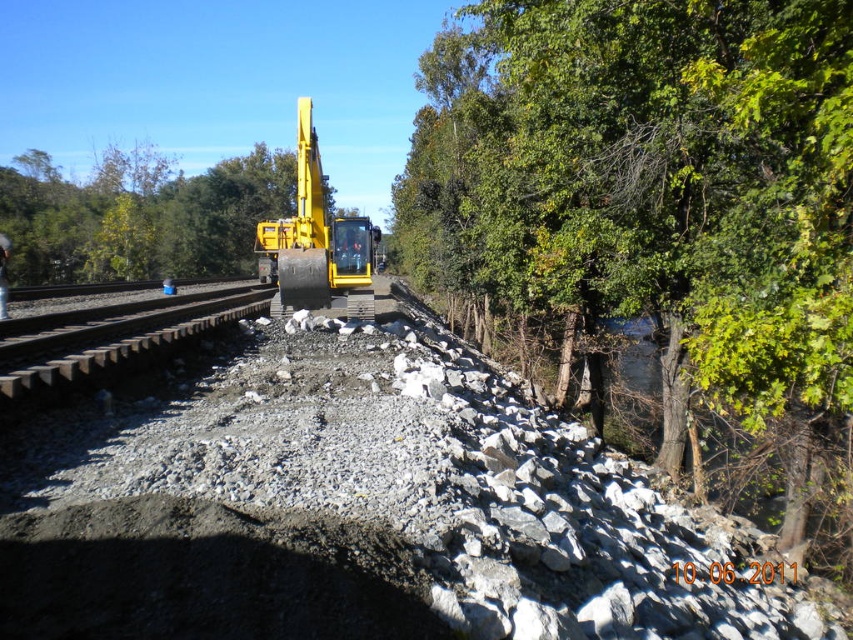
You are a pedestrian standing on the sidewalk next to the railway track. You see the green leafy tree at center and the gray gravel train track at left. Which object is higher in elevation?

The green leafy tree at center is above the gray gravel train track at left, so the green leafy tree at center is higher in elevation.

You are a surveyor standing at point 0.5, 0.5 in the image coordinate system. You need to locate the green leafy tree at center. In which direction should you move to reach it?

The green leafy tree at center is located at point (x=140, y=216). Since your current position is at (x=426, y=320), you should move towards the northwest direction to reach it.

You are a worker standing near the railway tracks and need to move the yellow metallic excavator at center to a safer location away from the green leafy tree at center. Which object should you move first to create space?

You should move the yellow metallic excavator at center first because it is closer to you than the green leafy tree at center, so moving it will create space between them.